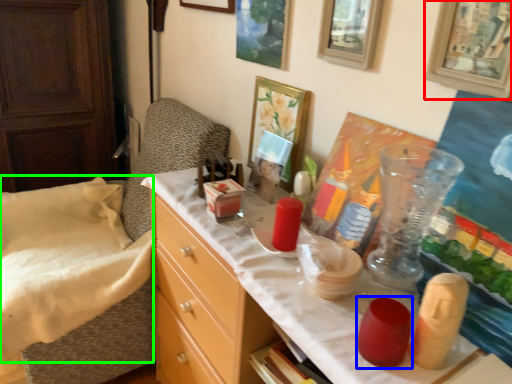
Question: Which object is the farthest from picture frame (highlighted by a red box)? Choose among these: candle holder (highlighted by a blue box) or sheet (highlighted by a green box).

Choices:
 (A) candle holder
 (B) sheet

Answer: (B)